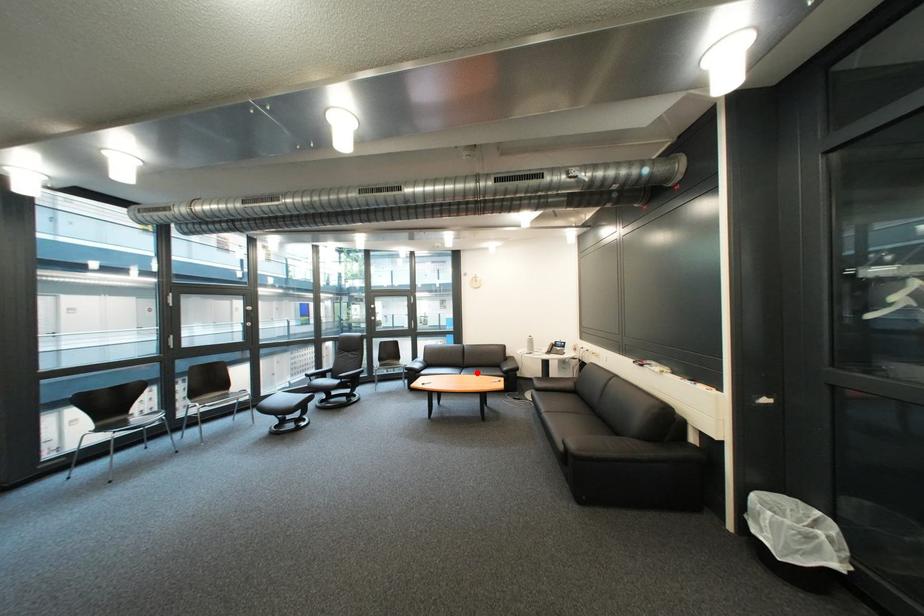
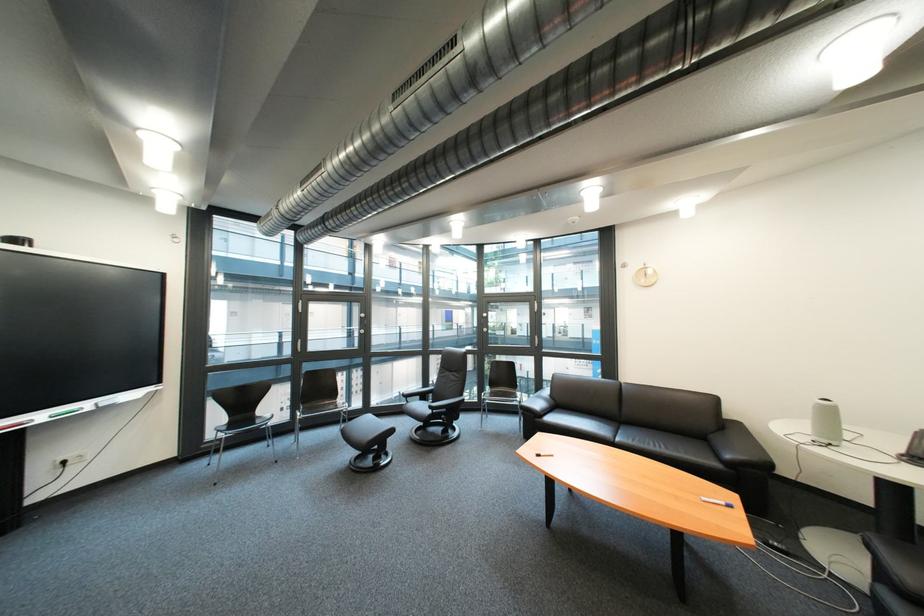
Question: I am providing you with two images of the same scene from different viewpoints. Image1 has a red point marked. In image2, the corresponding 3D location appears at what relative position? Reply with the corresponding letter.

Choices:
 (A) Closer
 (B) Farther

Answer: (A)